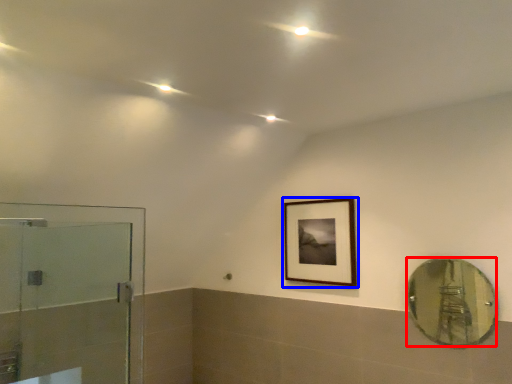
Question: Which object appears closest to the camera in this image, mirror (highlighted by a red box) or picture frame (highlighted by a blue box)?

Choices:
 (A) mirror
 (B) picture frame

Answer: (A)